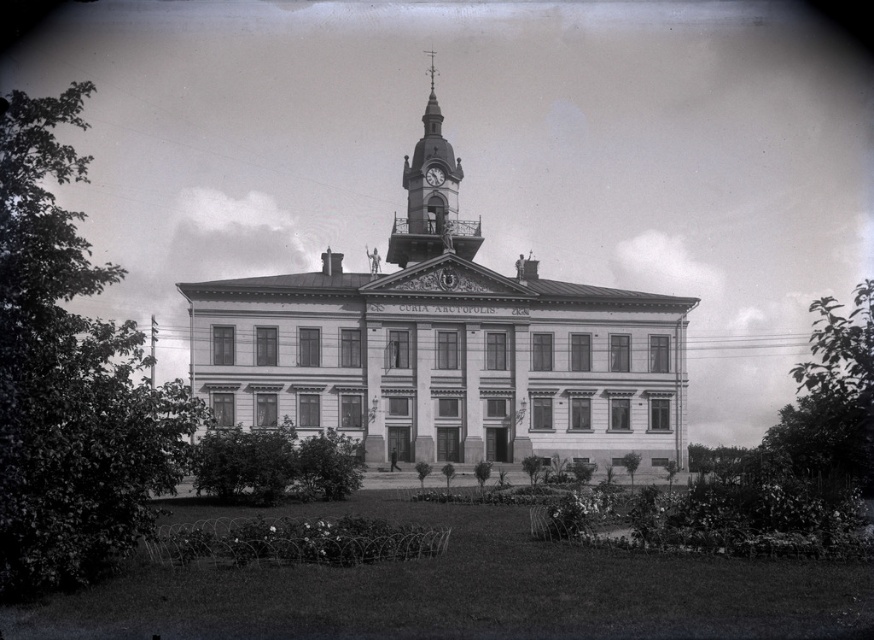
Question: Is smooth metal clock tower at center positioned before metallic clock at center?

Choices:
 (A) no
 (B) yes

Answer: (B)

Question: Can you confirm if smooth metal clock tower at center is positioned below metallic clock at center?

Choices:
 (A) no
 (B) yes

Answer: (B)

Question: Considering the relative positions of smooth metal clock tower at center and metallic clock at center in the image provided, where is smooth metal clock tower at center located with respect to metallic clock at center?

Choices:
 (A) below
 (B) above

Answer: (A)